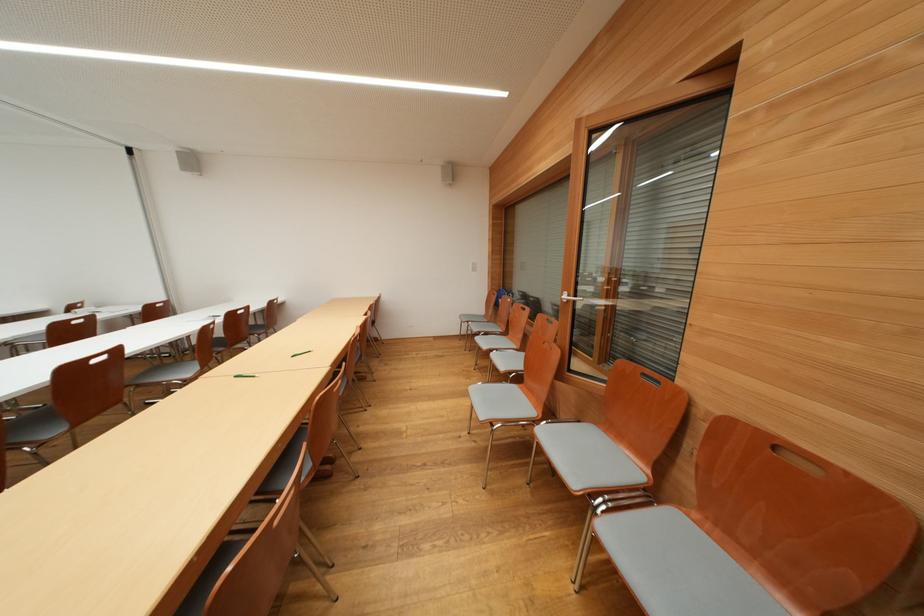
In order to click on silver window handle in this screenshot , I will do `click(569, 297)`.